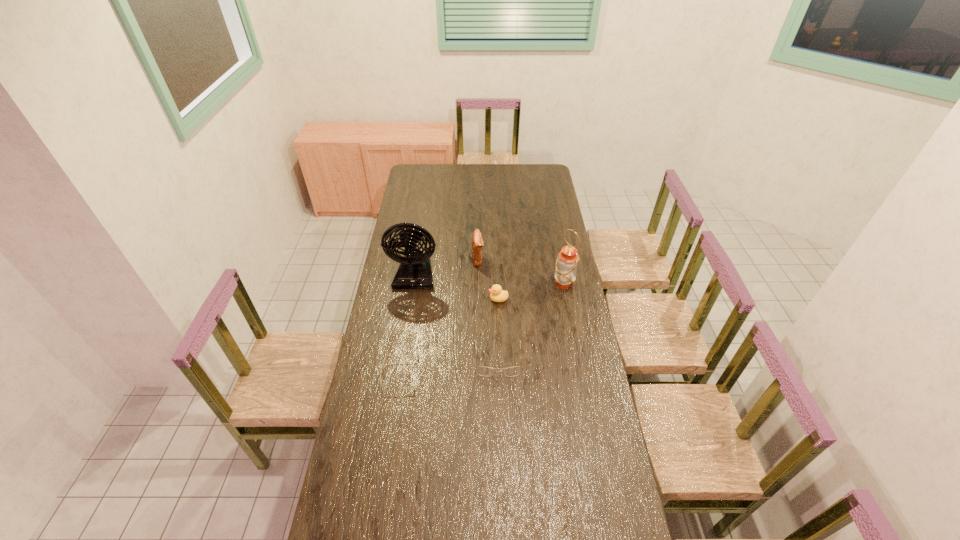
This screenshot has height=540, width=960. Find the location of `free point at the right edge`. free point at the right edge is located at coordinates (603, 404).

Find the location of a particular element. free space at the far right corner is located at coordinates (542, 170).

Find the location of a particular element. This screenshot has height=540, width=960. free spot between the oil lamp and the fourth tallest object is located at coordinates (531, 291).

This screenshot has height=540, width=960. What are the coordinates of `free point between the fan and the third shortest object` in the screenshot? It's located at (457, 287).

The image size is (960, 540). I want to click on vacant area between the oil lamp and the fan, so point(490,279).

Where is `free space between the right spectacles and the fan`? Image resolution: width=960 pixels, height=540 pixels. free space between the right spectacles and the fan is located at coordinates (457, 317).

In order to click on free space between the clutch bag and the left spectacles in this screenshot , I will do `click(439, 318)`.

What are the coordinates of `vacant area that lies between the oil lamp and the third tallest object` in the screenshot? It's located at (520, 271).

In order to click on vacant space that is in between the shortest object and the right spectacles in this screenshot , I will do `click(449, 368)`.

This screenshot has height=540, width=960. I want to click on vacant space in between the third tallest object and the fan, so click(x=446, y=267).